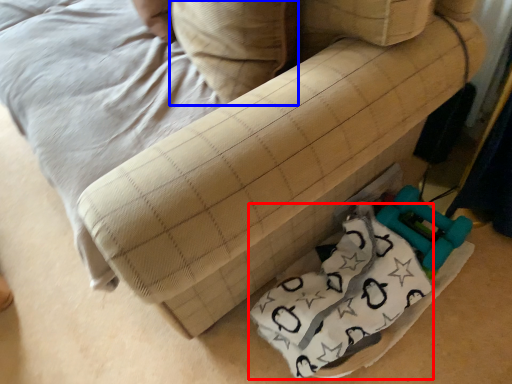
Question: Which object is further to the camera taking this photo, material (highlighted by a red box) or pillow (highlighted by a blue box)?

Choices:
 (A) material
 (B) pillow

Answer: (A)